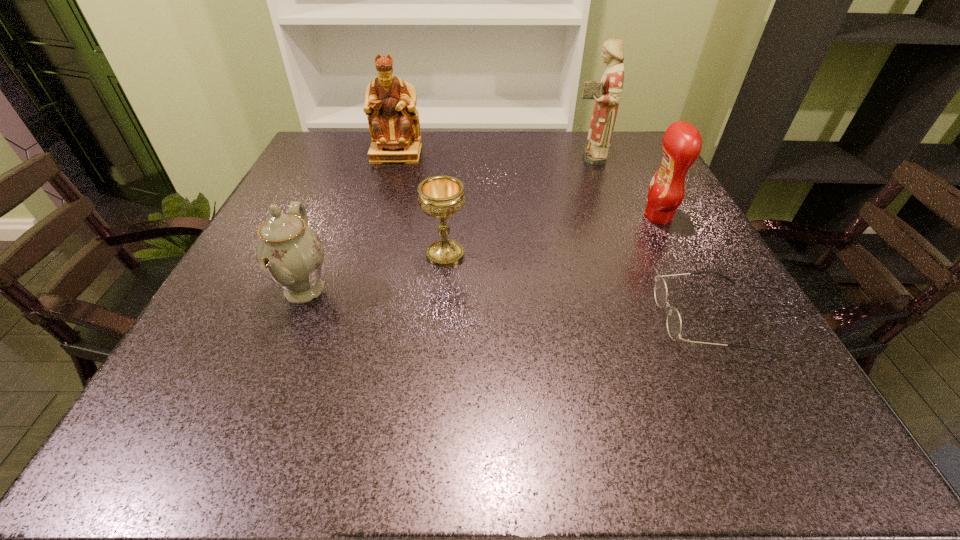
At what (x,y) coordinates should I click in order to perform the action: click on the taller figurine. Please return your answer as a coordinate pair (x, y). This screenshot has width=960, height=540. Looking at the image, I should click on coord(607,93).

Locate an element on the screen. This screenshot has height=540, width=960. the right figurine is located at coordinates (607, 93).

This screenshot has height=540, width=960. Identify the location of the fifth shortest object. (390, 102).

In order to click on the shorter figurine in this screenshot , I will do [390, 102].

Find the location of a particular element. condiment is located at coordinates (682, 143).

Where is `chinaware`? The width and height of the screenshot is (960, 540). chinaware is located at coordinates (289, 253).

This screenshot has width=960, height=540. In order to click on the second shortest object in this screenshot , I will do `click(441, 197)`.

Locate an element on the screen. This screenshot has height=540, width=960. chalice is located at coordinates (441, 197).

I want to click on spectacles, so click(x=674, y=325).

At what (x,y) coordinates should I click in order to perform the action: click on vacant space located on the front-facing side of the tallest object. Please return your answer as a coordinate pair (x, y). The image size is (960, 540). Looking at the image, I should click on (540, 157).